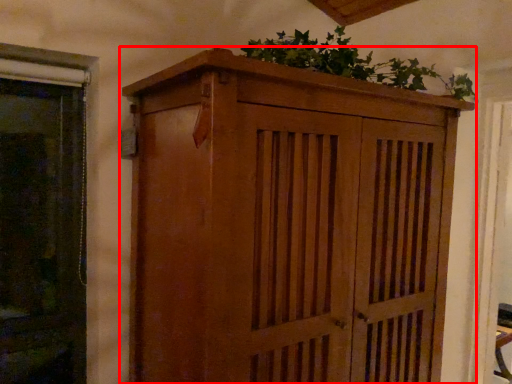
Question: Considering the relative positions of cupboard (annotated by the red box) and houseplant in the image provided, where is cupboard (annotated by the red box) located with respect to the staircase?

Choices:
 (A) right
 (B) left

Answer: (B)